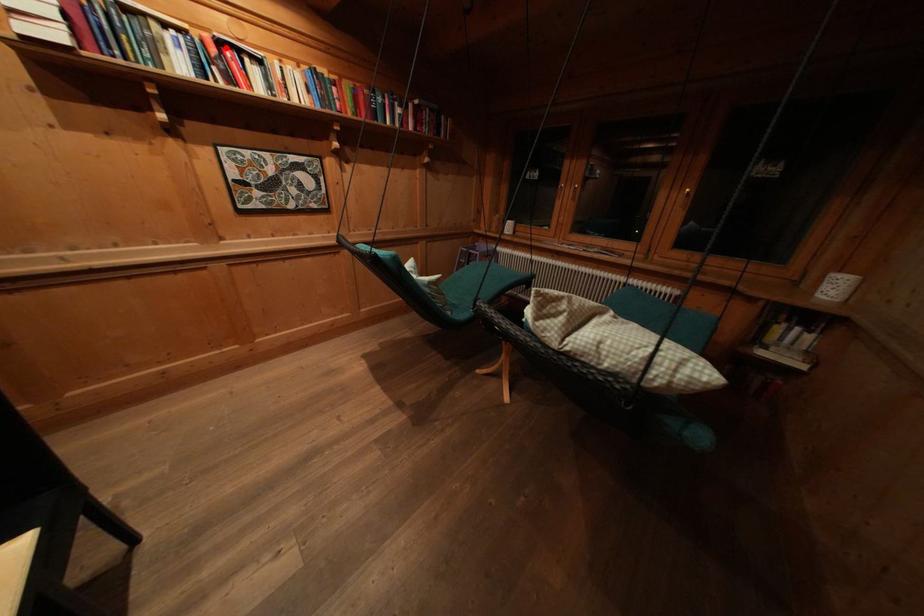
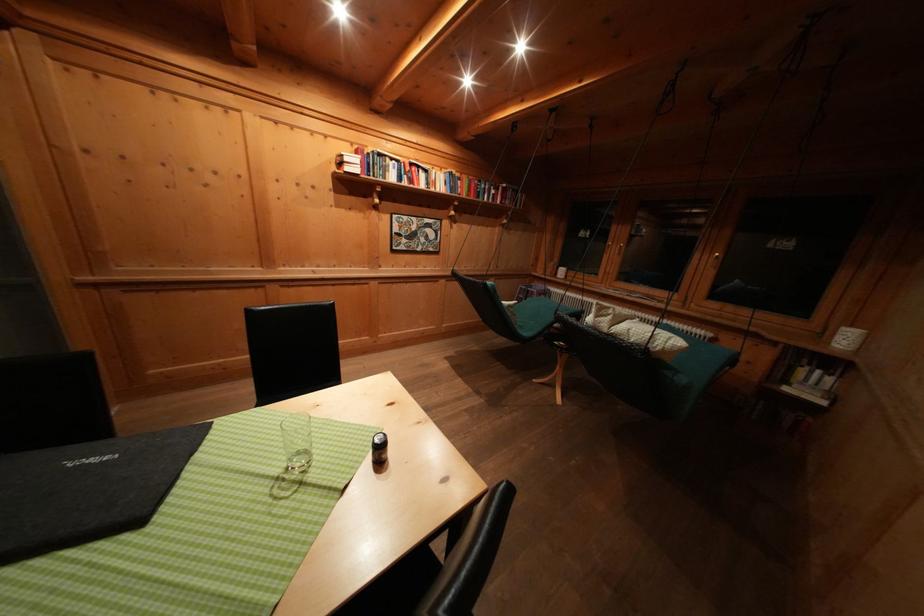
Find the pixel in the second image that matches the highlighted location in the first image.

(418, 169)